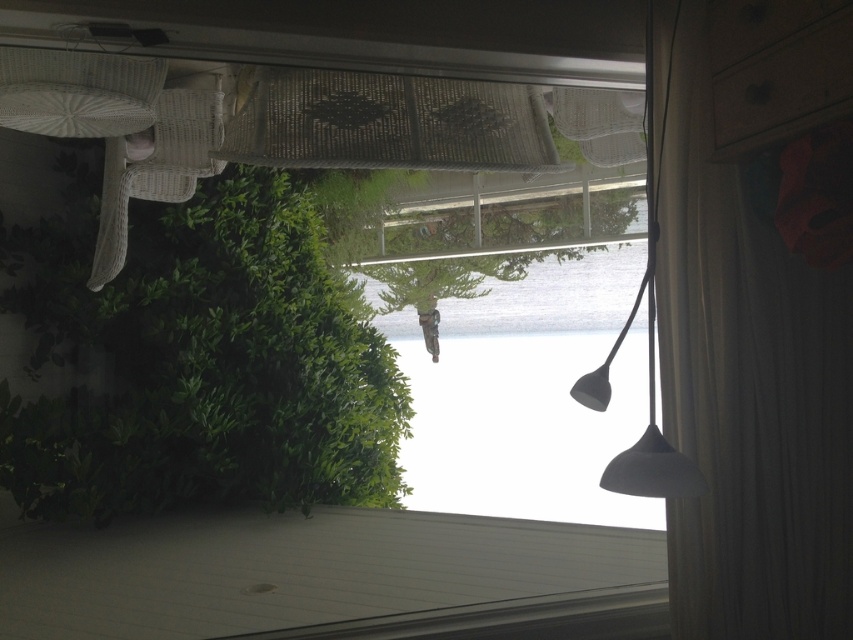
You are a delivery robot with a package that is 10 feet long. You need to move through the space between the transparent glass window at center and the black matte lamp at center. Can you fit through the space between them?

The transparent glass window at center and black matte lamp at center are 9.83 feet apart from each other. Since your package is 10 feet long, it is slightly longer than the available space, so you cannot fit through the space between them.

You are trying to hang a new picture frame on the wall between the transparent glass window at center and the black matte lamp at center. Based on their positions, where should you place the frame so it hangs above the window but below the lamp?

The transparent glass window at center is below the black matte lamp at center, so placing the frame between them would require positioning it above the window but below the lamp.

You are trying to determine which object in the scene is bigger. You see the transparent glass window at center and the black matte lamp at center. Which one is larger?

The transparent glass window at center has a larger size compared to the black matte lamp at center, so the transparent glass window at center is larger.